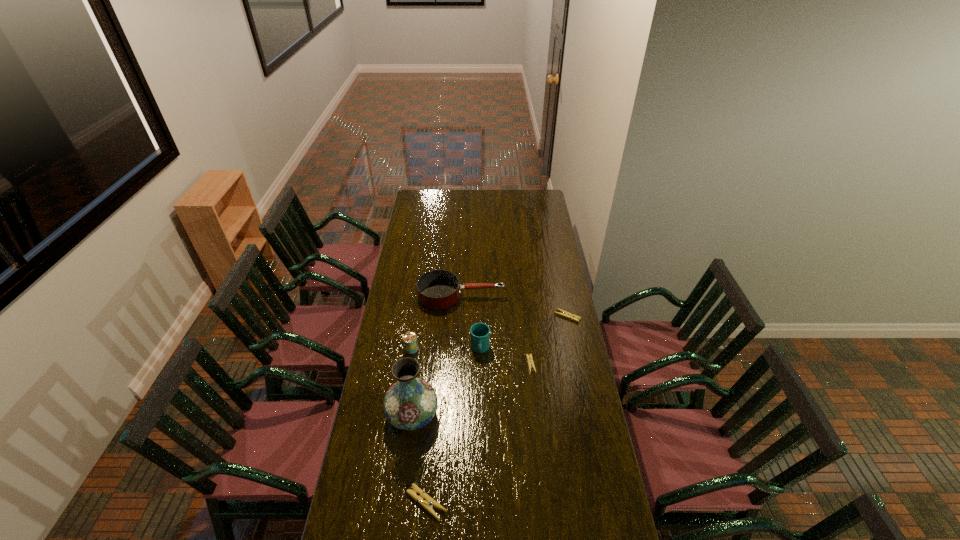
You are a GUI agent. You are given a task and a screenshot of the screen. Output one action in this format:
    pyautogui.click(x=<x>, y=<y>)
    Task: Click on the can
    
    Given the screenshot: What is the action you would take?
    pyautogui.click(x=410, y=342)

Find the location of a particular element. Image resolution: width=960 pixels, height=540 pixels. free spot located 0.170m on the back of the tallest clothespin is located at coordinates (432, 440).

Image resolution: width=960 pixels, height=540 pixels. In order to click on free space located 0.050m on the front of the shortest object in this screenshot , I will do `click(533, 384)`.

Identify the location of vacant space located 0.050m on the left of the rightmost clothespin. (544, 316).

This screenshot has height=540, width=960. I want to click on free space located on the handle side of the cup, so click(x=480, y=441).

This screenshot has height=540, width=960. Find the location of `vacant region located 0.280m on the handle side of the fourth tallest object`. vacant region located 0.280m on the handle side of the fourth tallest object is located at coordinates [x=559, y=296].

Where is `free space located on the back of the tallest object`? The width and height of the screenshot is (960, 540). free space located on the back of the tallest object is located at coordinates (423, 333).

Find the location of a particular element. The width and height of the screenshot is (960, 540). vacant area situated 0.260m on the right of the can is located at coordinates (478, 349).

The height and width of the screenshot is (540, 960). What are the coordinates of `object located at the near edge` in the screenshot? It's located at (424, 500).

The width and height of the screenshot is (960, 540). What are the coordinates of `pan that is at the left edge` in the screenshot? It's located at (439, 289).